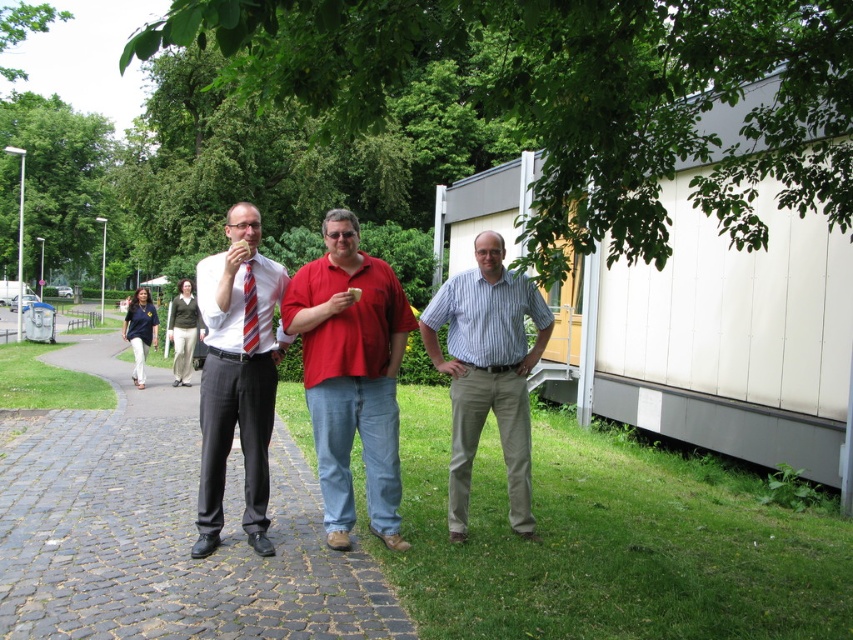
Which of these two, cobblestone pavement at lower left or striped cotton shirt at center, stands taller?

striped cotton shirt at center

Is cobblestone pavement at lower left closer to the viewer compared to striped cotton shirt at center?

Yes, cobblestone pavement at lower left is in front of striped cotton shirt at center.

This screenshot has width=853, height=640. What do you see at coordinates (165, 541) in the screenshot?
I see `cobblestone pavement at lower left` at bounding box center [165, 541].

Locate an element on the screen. This screenshot has height=640, width=853. cobblestone pavement at lower left is located at coordinates (165, 541).

Is cobblestone pavement at lower left taller than red striped tie at center?

In fact, cobblestone pavement at lower left may be shorter than red striped tie at center.

Where is `cobblestone pavement at lower left`? cobblestone pavement at lower left is located at coordinates (165, 541).

In order to click on cobblestone pavement at lower left in this screenshot , I will do `click(165, 541)`.

Who is higher up, cobblestone pavement at lower left or matte red shirt at center?

matte red shirt at center

Locate an element on the screen. Image resolution: width=853 pixels, height=640 pixels. cobblestone pavement at lower left is located at coordinates (165, 541).

This screenshot has height=640, width=853. Identify the location of cobblestone pavement at lower left. (165, 541).